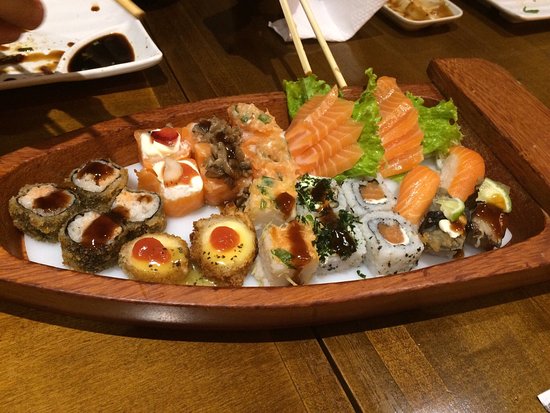
Find the location of a particular element. chop sticks is located at coordinates (306, 56), (328, 51), (139, 9).